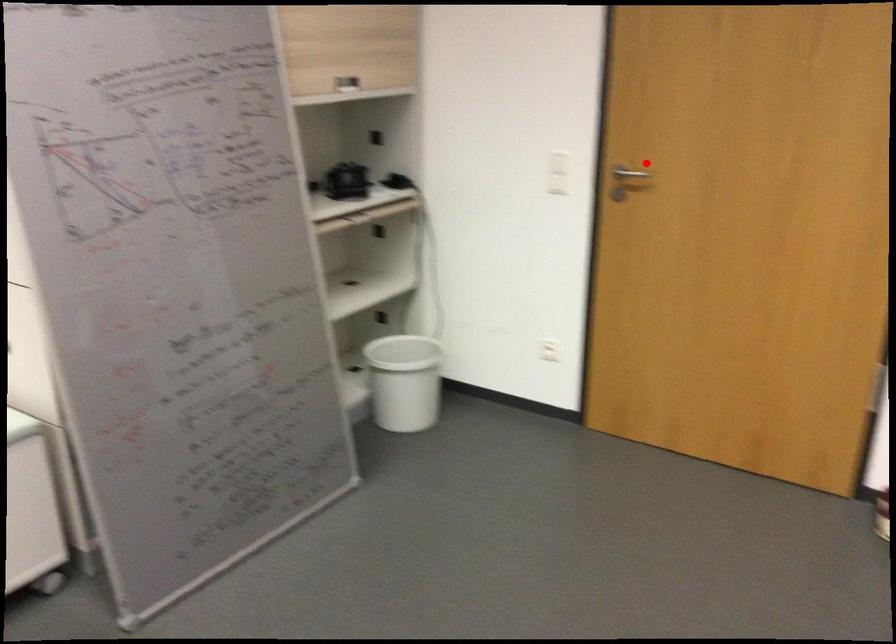
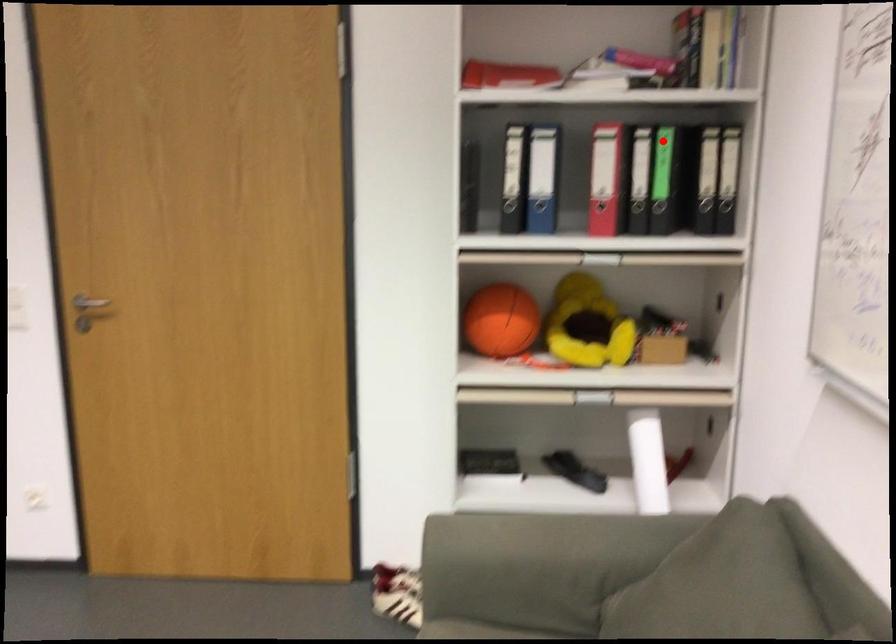
I am providing you with two images of the same scene from different viewpoints. A red point is marked on the first image and another point is marked on the second image. Is the marked point in image1 the same physical position as the marked point in image2?

No